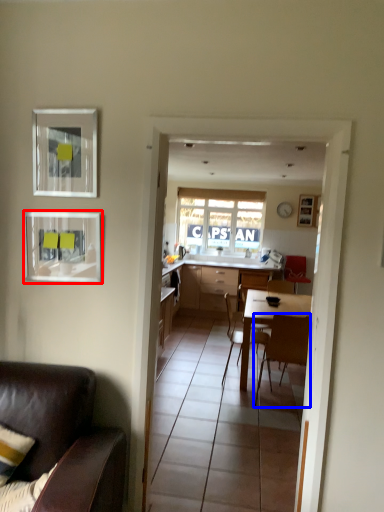
Question: Which of the following is the farthest to the observer, picture frame (highlighted by a red box) or chair (highlighted by a blue box)?

Choices:
 (A) picture frame
 (B) chair

Answer: (B)